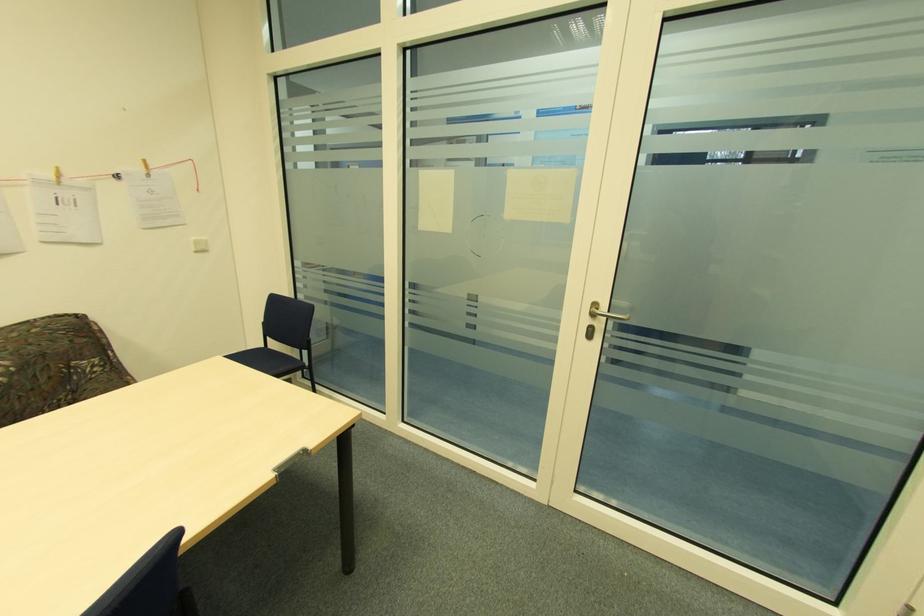
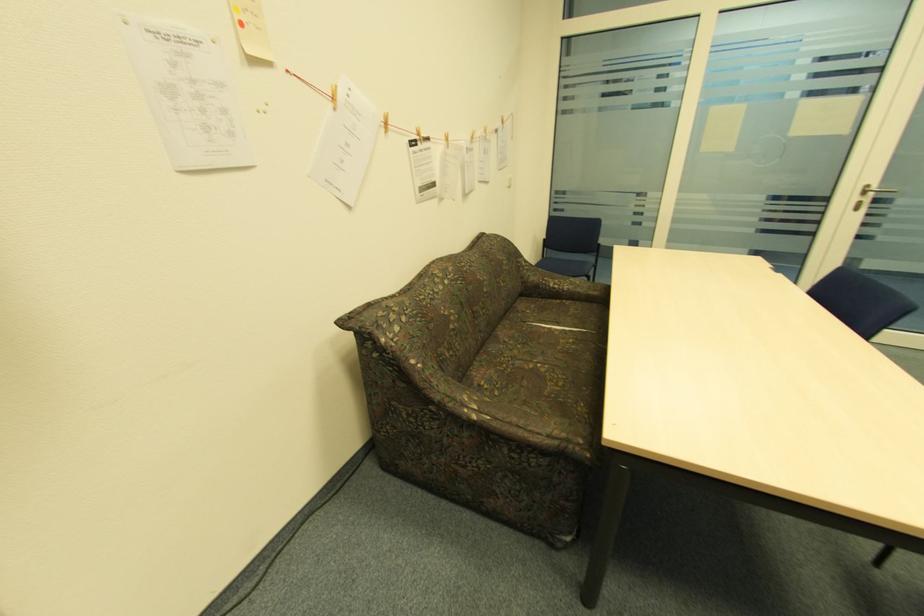
Question: I am providing you with two images of the same scene from different viewpoints. Please identify which objects are invisible in image2.

Choices:
 (A) wooden clothespin
 (B) patterned sofa armrest
 (C) sofa sitting surface
 (D) none of these

Answer: (D)